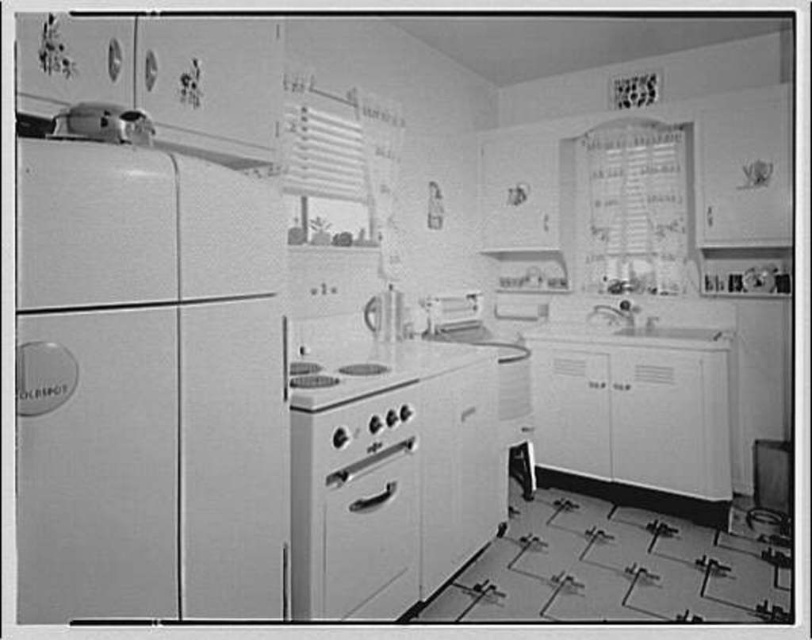
You are a chef preparing to move the white glossy oven at center closer to the sink, which is behind the white matte refrigerator at left. Can you move the oven without moving the refrigerator first?

The white matte refrigerator at left is in front of the white glossy oven at center, so you must move the refrigerator first to access the oven.

You are standing in the vintage kitchen and need to locate both the white glossy oven at center and the white glossy stove at center. According to the scene, which one is positioned to the right of the other?

The white glossy oven at center is to the right of the white glossy stove at center.

You are a chef preparing to place a large baking tray on the white glossy oven at center. The tray is 10 inches wide. Can you fit it on the oven without overlapping the white glossy stove at center?

The white glossy oven at center and white glossy stove at center are 9.22 inches apart. Since the tray is 10 inches wide, it would overlap the stove when placed on the oven.